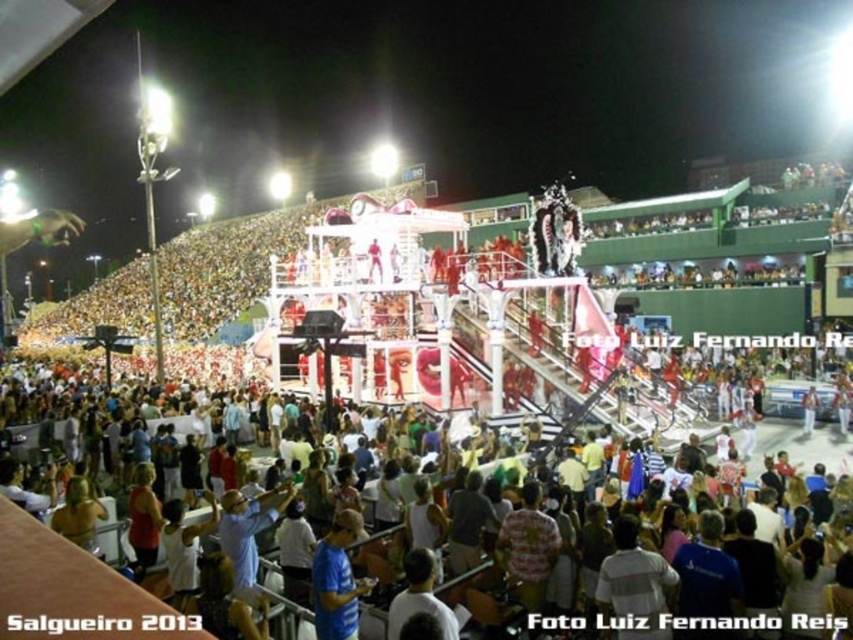
You are standing at the origin point of the coordinate system in the image. You want to reach the white cotton crowd at lower center. What direction should you move in?

You should move towards the point with coordinates 0.686 on the x axis and 0.114 on the y axis to reach the white cotton crowd at lower center.

You are a photographer at the event and want to capture both the white cotton crowd at lower center and the blue fabric shirt at lower center in a single frame. Which object should you focus on to ensure both are visible without zooming in or out?

Since the white cotton crowd at lower center is wider than the blue fabric shirt at lower center, you should focus on the white cotton crowd at lower center to ensure both are visible without adjusting the zoom.